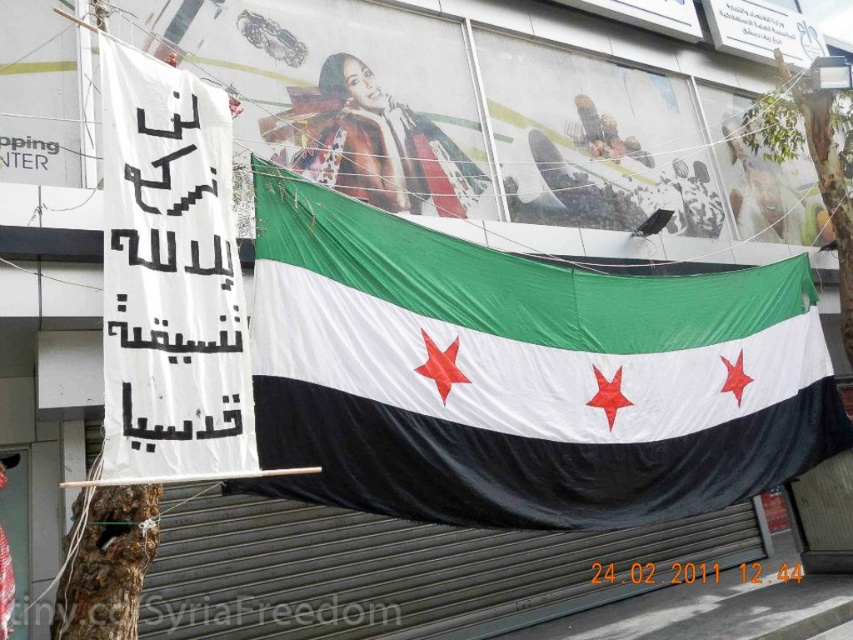
Question: Does textured fabric flag at center appear on the left side of matte red scarf at center?

Choices:
 (A) yes
 (B) no

Answer: (B)

Question: Which of the following is the farthest from the observer?

Choices:
 (A) matte red scarf at center
 (B) textured fabric flag at center

Answer: (A)

Question: Observing the image, what is the correct spatial positioning of textured fabric flag at center in reference to matte red scarf at center?

Choices:
 (A) below
 (B) above

Answer: (A)

Question: Does textured fabric flag at center have a lesser width compared to matte red scarf at center?

Choices:
 (A) yes
 (B) no

Answer: (B)